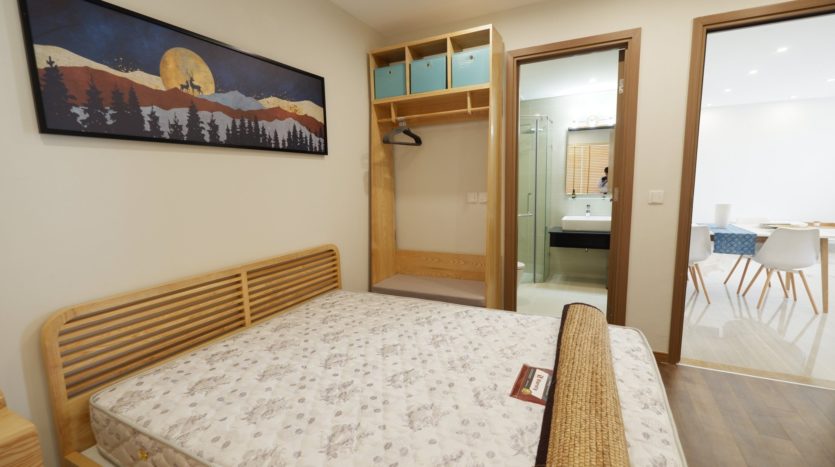
Find the location of a particular element. Image resolution: width=835 pixels, height=467 pixels. wall mounted sink is located at coordinates (580, 224).